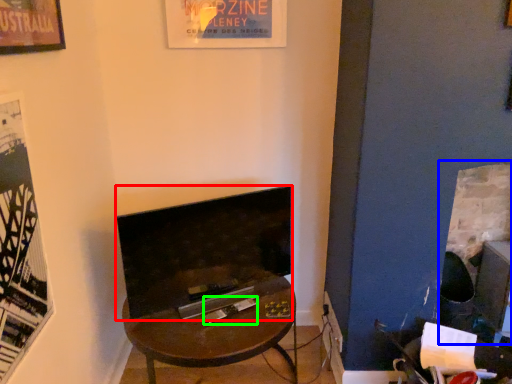
Question: Which is farther away from fireplace (highlighted by a red box)? fireplace (highlighted by a blue box) or magazine (highlighted by a green box)?

Choices:
 (A) fireplace
 (B) magazine

Answer: (A)